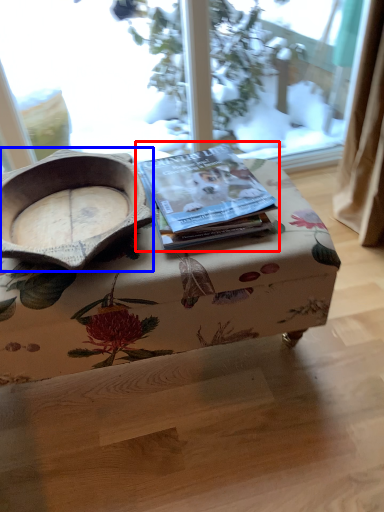
Question: Among these objects, which one is farthest to the camera, paperback book (highlighted by a red box) or bowl (highlighted by a blue box)?

Choices:
 (A) paperback book
 (B) bowl

Answer: (A)